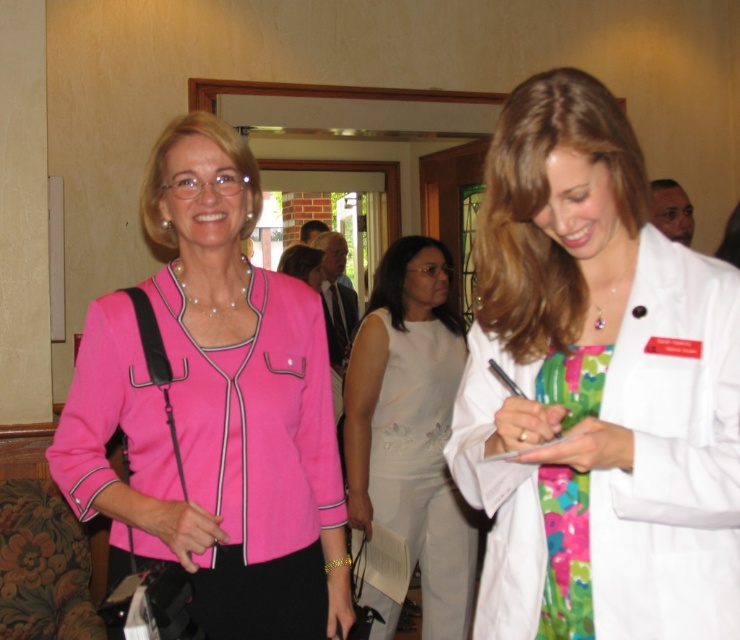
Consider the image. Does pink fabric jacket at center appear under floral fabric dress at center?

No.

Is pink fabric jacket at center positioned at the back of floral fabric dress at center?

Yes, it is.

You are a GUI agent. You are given a task and a screenshot of the screen. Output one action in this format:
    pyautogui.click(x=<x>, y=<y>)
    Task: Click on the pink fabric jacket at center
    The image size is (740, 640).
    Given the screenshot: What is the action you would take?
    [215, 410]

The width and height of the screenshot is (740, 640). I want to click on pink fabric jacket at center, so click(x=215, y=410).

What do you see at coordinates (596, 388) in the screenshot? The width and height of the screenshot is (740, 640). I see `white matte lab coat at right` at bounding box center [596, 388].

Is white matte lab coat at right above white satin dress at center?

Correct, white matte lab coat at right is located above white satin dress at center.

Which is in front, point (561, 424) or point (408, 282)?

Point (561, 424) is more forward.

Locate an element on the screen. The width and height of the screenshot is (740, 640). white matte lab coat at right is located at coordinates (596, 388).

Does point (568, 170) lie in front of point (578, 545)?

Yes, point (568, 170) is closer to viewer.

Is white matte lab coat at right smaller than floral fabric dress at center?

Actually, white matte lab coat at right might be larger than floral fabric dress at center.

Between point (565, 160) and point (565, 570), which one is positioned behind?

The point (565, 570) is more distant.

Locate an element on the screen. The height and width of the screenshot is (640, 740). white matte lab coat at right is located at coordinates (596, 388).